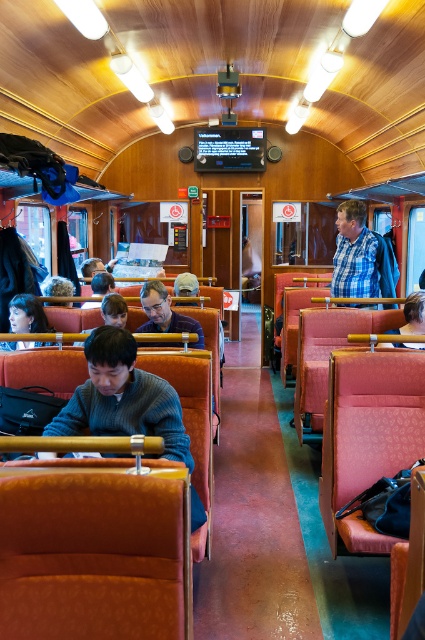
You are a passenger on a train and want to know if the person wearing the matte black sweater at center is close enough to the person with matte black hair at lower left to have a conversation without raising your voice. Can you determine this based on their distance?

The matte black sweater at center and matte black hair at lower left are 81.87 centimeters apart from each other, so they are close enough to converse without raising their voices since the distance is within a comfortable conversational range.

You are standing at the entrance of the train carriage and want to find a spot to place your backpack. You notice the point at coordinates (166,314). What object is located at that point?

The object at point (166,314) is the matte black sweater at center.